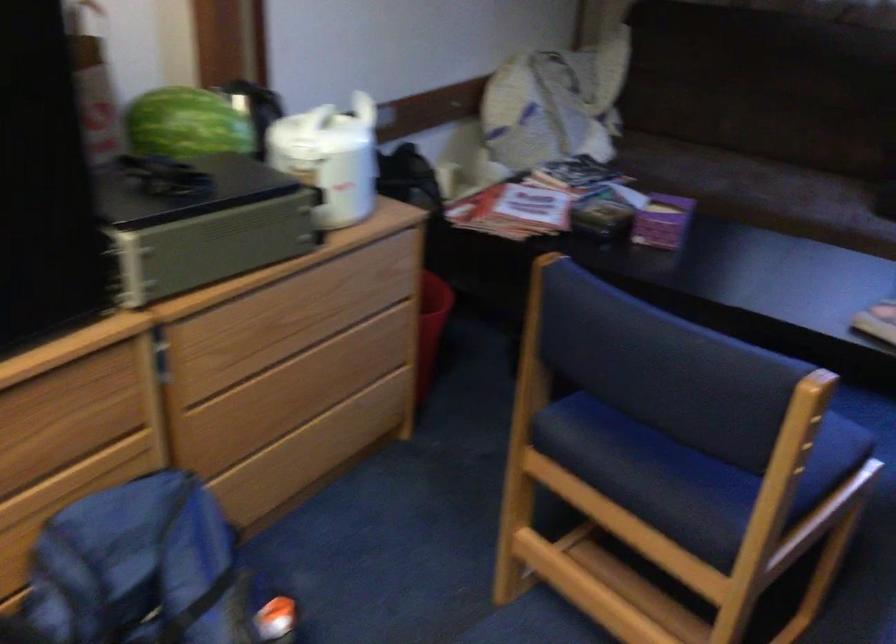
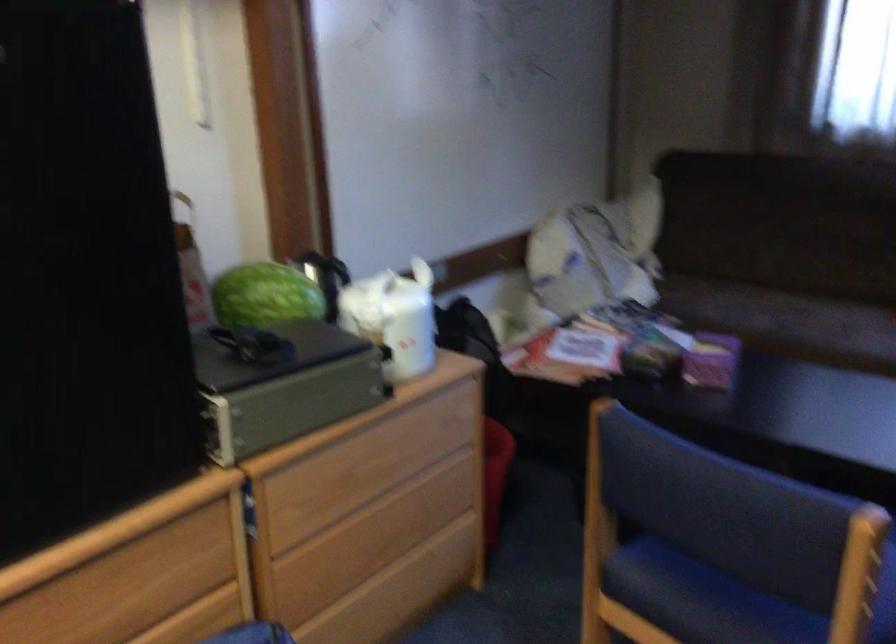
Locate, in the second image, the point that corresponds to (x=429, y=330) in the first image.

(495, 474)